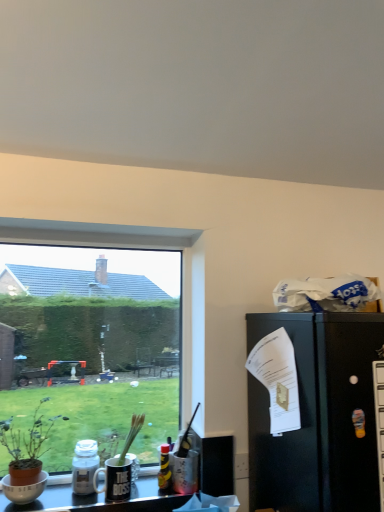
In order to click on free space above brown terracotta pot at left (from a real-world perspective) in this screenshot , I will do `click(31, 392)`.